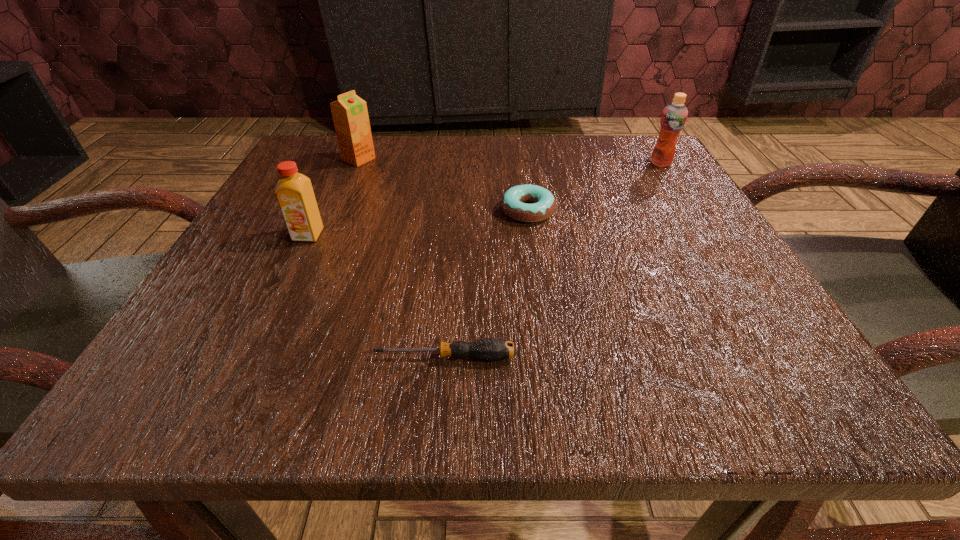
Locate which orange juice ranks in proximity to the shortest object. Please provide its 2D coordinates. Your answer should be formatted as a tuple, i.e. [(x, y)], where the tuple contains the x and y coordinates of a point satisfying the conditions above.

[(294, 192)]

This screenshot has height=540, width=960. What are the coordinates of `orange juice that is the closest one to the nearest object` in the screenshot? It's located at (294, 192).

The image size is (960, 540). What are the coordinates of `free space that satisfies the following two spatial constraints: 1. on the back side of the screwdriver; 2. on the left side of the rightmost object` in the screenshot? It's located at (459, 163).